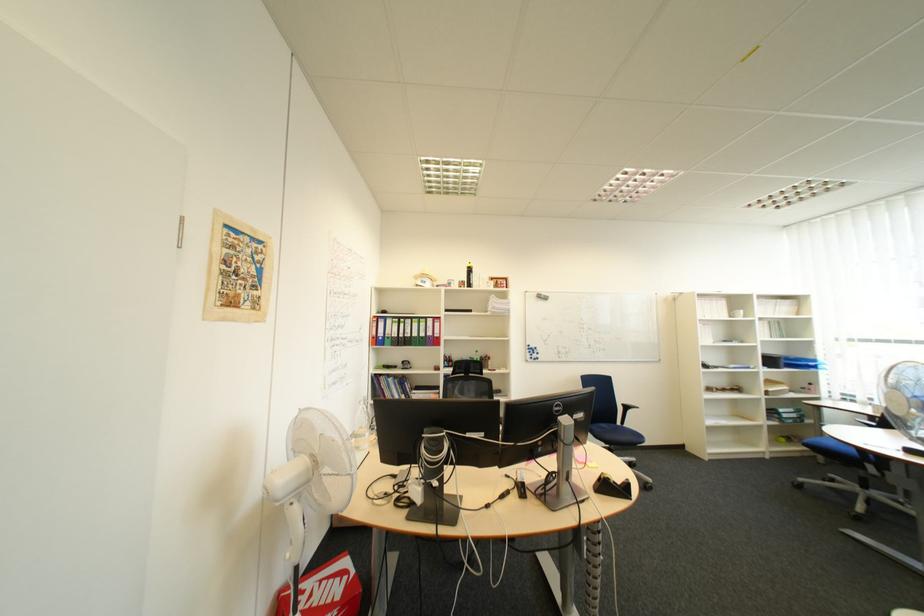
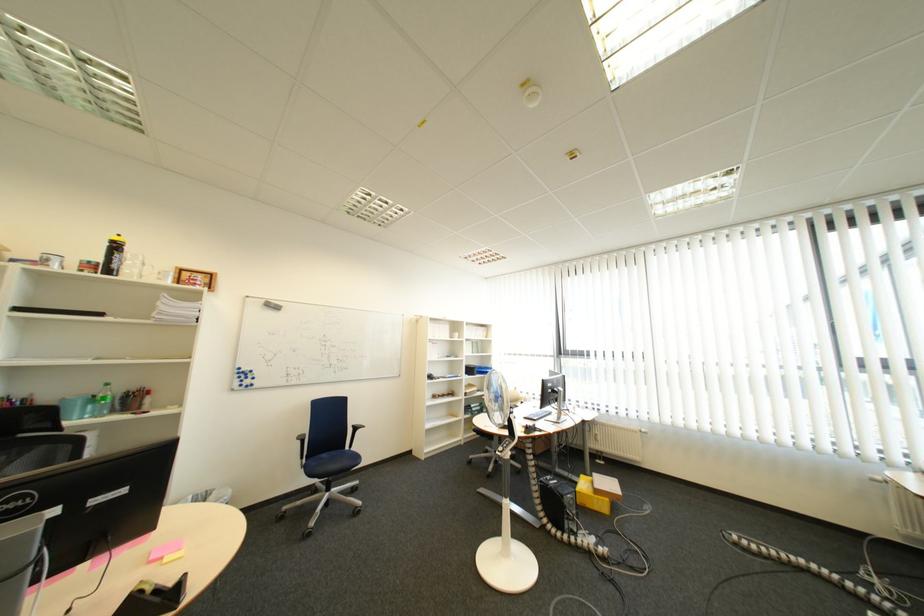
Question: The camera is either moving clockwise (left) or counter-clockwise (right) around the object. The first image is from the beginning of the video and the second image is from the end. Is the camera moving left or right when shooting the video?

Choices:
 (A) Left
 (B) Right

Answer: (A)